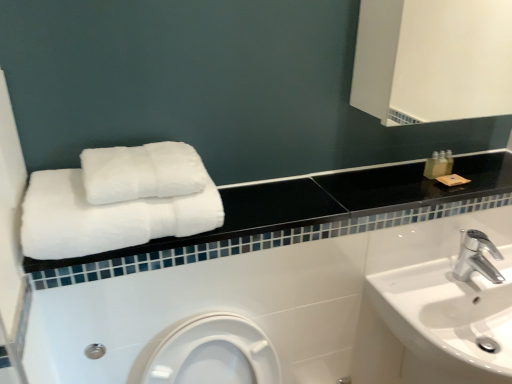
Describe the element at coordinates (434, 166) in the screenshot. I see `translucent plastic bottle at upper right` at that location.

The width and height of the screenshot is (512, 384). I want to click on translucent plastic bottle at upper right, so click(x=434, y=166).

Image resolution: width=512 pixels, height=384 pixels. What are the coordinates of `white fluffy towels at upper left, which is the 2th towel from top to bottom` in the screenshot? It's located at (105, 217).

Where is `white glossy sink at lower right`? The image size is (512, 384). white glossy sink at lower right is located at coordinates (437, 324).

Measure the distance between white soft towels at upper left and camera.

The depth of white soft towels at upper left is 33.00 inches.

Image resolution: width=512 pixels, height=384 pixels. Find the location of `translucent plastic bottle at upper right`. translucent plastic bottle at upper right is located at coordinates (434, 166).

From the image's perspective, is white soft towels at upper left below white glossy sink at lower right?

Actually, white soft towels at upper left appears above white glossy sink at lower right in the image.

Which is behind, white soft towels at upper left or white glossy sink at lower right?

white glossy sink at lower right is more distant.

From a real-world perspective, is white soft towels at upper left on top of white glossy sink at lower right?

Yes, from a real-world perspective, white soft towels at upper left is over white glossy sink at lower right

Can you see white soft towels at upper left touching white glossy sink at lower right?

white soft towels at upper left and white glossy sink at lower right are not in contact.

What's the angular difference between translucent plastic bottle at upper right and white glossy sink at lower right's facing directions?

The angle between the facing direction of translucent plastic bottle at upper right and the facing direction of white glossy sink at lower right is 2.08 degrees.

Can you confirm if translucent plastic bottle at upper right is shorter than white glossy sink at lower right?

Indeed, translucent plastic bottle at upper right has a lesser height compared to white glossy sink at lower right.

Which is nearer, (x=439, y=175) or (x=417, y=338)?

Point (x=439, y=175) appears to be farther away from the viewer than point (x=417, y=338).

Would you say translucent plastic bottle at upper right contains white glossy sink at lower right?

No.

Does translucent plastic bottle at upper right have a lesser height compared to white fluffy towels at center, the 1th towel viewed from the top?

No, translucent plastic bottle at upper right is not shorter than white fluffy towels at center, the 1th towel viewed from the top.

I want to click on towel that is the 2nd one above the translucent plastic bottle at upper right (from a real-world perspective), so click(x=142, y=172).

In the scene shown: Which is farther, (440, 155) or (124, 169)?

The point (440, 155) is more distant.

From a real-world perspective, between translucent plastic bottle at upper right and white fluffy towels at center, the 1th towel viewed from the top, who is vertically lower?

translucent plastic bottle at upper right, from a real-world perspective.

Considering the positions of points (489, 355) and (465, 251), is point (489, 355) closer to camera compared to point (465, 251)?

That is True.

Considering the relative sizes of white glossy sink at lower right and silver metallic faucet at lower right in the image provided, is white glossy sink at lower right wider than silver metallic faucet at lower right?

Indeed, white glossy sink at lower right has a greater width compared to silver metallic faucet at lower right.

Does white glossy sink at lower right appear on the left side of silver metallic faucet at lower right?

In fact, white glossy sink at lower right is to the right of silver metallic faucet at lower right.

Can you confirm if translucent plastic bottle at upper right is taller than white soft towels at upper left?

Indeed, translucent plastic bottle at upper right has a greater height compared to white soft towels at upper left.

Does translucent plastic bottle at upper right have a greater width compared to white soft towels at upper left?

Incorrect, the width of translucent plastic bottle at upper right does not surpass that of white soft towels at upper left.

Which is behind, point (441, 156) or point (498, 169)?

The point (441, 156) is farther from the camera.

Where is `balustrade in front of the translucent plastic bottle at upper right`? Image resolution: width=512 pixels, height=384 pixels. balustrade in front of the translucent plastic bottle at upper right is located at coordinates (302, 216).

You are a GUI agent. You are given a task and a screenshot of the screen. Output one action in this format:
    pyautogui.click(x=<x>, y=<y>)
    Task: Click on the towel above the white soft towels at upper left (from the image's perspective)
    
    Given the screenshot: What is the action you would take?
    pyautogui.click(x=142, y=172)

Are white fluffy towels at center, the 1th towel viewed from the top, and white soft towels at upper left located far from each other?

white fluffy towels at center, the 1th towel viewed from the top, is near white soft towels at upper left, not far away.

Considering the relative sizes of white fluffy towels at center, acting as the 2th towel starting from the bottom, and white soft towels at upper left in the image provided, is white fluffy towels at center, acting as the 2th towel starting from the bottom, wider than white soft towels at upper left?

In fact, white fluffy towels at center, acting as the 2th towel starting from the bottom, might be narrower than white soft towels at upper left.

Considering the sizes of white fluffy towels at center, acting as the 2th towel starting from the bottom, and white soft towels at upper left in the image, is white fluffy towels at center, acting as the 2th towel starting from the bottom, taller or shorter than white soft towels at upper left?

white fluffy towels at center, acting as the 2th towel starting from the bottom, is taller than white soft towels at upper left.

Does translucent plastic bottle at upper right have a lesser height compared to white fluffy towels at upper left, which is counted as the first towel, starting from the bottom?

Yes, translucent plastic bottle at upper right is shorter than white fluffy towels at upper left, which is counted as the first towel, starting from the bottom.

What's the angular difference between translucent plastic bottle at upper right and white fluffy towels at upper left, which is counted as the first towel, starting from the bottom,'s facing directions?

The facing directions of translucent plastic bottle at upper right and white fluffy towels at upper left, which is counted as the first towel, starting from the bottom, are 0.426 degrees apart.

Looking at this image, can you confirm if translucent plastic bottle at upper right is thinner than white fluffy towels at upper left, which is counted as the first towel, starting from the bottom?

Indeed, translucent plastic bottle at upper right has a lesser width compared to white fluffy towels at upper left, which is counted as the first towel, starting from the bottom.

Looking at this image, is translucent plastic bottle at upper right not inside white fluffy towels at upper left, which is the 2th towel from top to bottom?

translucent plastic bottle at upper right is positioned outside white fluffy towels at upper left, which is the 2th towel from top to bottom.

This screenshot has height=384, width=512. Find the location of `sink that is below the white soft towels at upper left (from the image's perspective)`. sink that is below the white soft towels at upper left (from the image's perspective) is located at coordinates (437, 324).

You are a GUI agent. You are given a task and a screenshot of the screen. Output one action in this format:
    pyautogui.click(x=<x>, y=<y>)
    Task: Click on the sink below the translucent plastic bottle at upper right (from a real-world perspective)
    The image size is (512, 384).
    Given the screenshot: What is the action you would take?
    pyautogui.click(x=437, y=324)

Which object lies further to the anchor point white fluffy towels at center, acting as the 2th towel starting from the bottom, silver metallic faucet at lower right or translucent plastic bottle at upper right?

Among the two, silver metallic faucet at lower right is located further to white fluffy towels at center, acting as the 2th towel starting from the bottom.

From the image, which object appears to be farther from white glossy sink at lower right, white fluffy towels at upper left, which is the 2th towel from top to bottom, or white fluffy towels at center, acting as the 2th towel starting from the bottom?

The object further to white glossy sink at lower right is white fluffy towels at center, acting as the 2th towel starting from the bottom.

Considering their positions, is translucent plastic bottle at upper right positioned further to silver metallic faucet at lower right than white soft towels at upper left?

white soft towels at upper left is positioned further to the anchor silver metallic faucet at lower right.

Estimate the real-world distances between objects in this image. Which object is closer to white fluffy towels at center, acting as the 2th towel starting from the bottom, white glossy sink at lower right or translucent plastic bottle at upper right?

white glossy sink at lower right is positioned closer to the anchor white fluffy towels at center, acting as the 2th towel starting from the bottom.

Looking at this image, estimate the real-world distances between objects in this image. Which object is closer to white fluffy towels at upper left, which is counted as the first towel, starting from the bottom, white fluffy towels at center, acting as the 2th towel starting from the bottom, or silver metallic faucet at lower right?

white fluffy towels at center, acting as the 2th towel starting from the bottom, is closer to white fluffy towels at upper left, which is counted as the first towel, starting from the bottom.

Which object lies further to the anchor point white soft towels at upper left, white fluffy towels at center, the 1th towel viewed from the top, or silver metallic faucet at lower right?

silver metallic faucet at lower right.

From the image, which object appears to be nearer to white fluffy towels at center, the 1th towel viewed from the top, translucent plastic bottle at upper right or white glossy sink at lower right?

white glossy sink at lower right.

Which object lies further to the anchor point white fluffy towels at center, acting as the 2th towel starting from the bottom, white glossy sink at lower right or white fluffy towels at upper left, which is counted as the first towel, starting from the bottom?

white glossy sink at lower right.

At what (x,y) coordinates should I click in order to perform the action: click on balustrade between translucent plastic bottle at upper right and white glossy sink at lower right in the up-down direction. Please return your answer as a coordinate pair (x, y). Looking at the image, I should click on coord(302,216).

This screenshot has width=512, height=384. I want to click on towel situated between white fluffy towels at upper left, which is the 2th towel from top to bottom, and silver metallic faucet at lower right from left to right, so click(142, 172).

At what (x,y) coordinates should I click in order to perform the action: click on balustrade between white fluffy towels at upper left, which is counted as the first towel, starting from the bottom, and white glossy sink at lower right. Please return your answer as a coordinate pair (x, y). This screenshot has width=512, height=384. Looking at the image, I should click on point(302,216).

The height and width of the screenshot is (384, 512). I want to click on tap located between white fluffy towels at upper left, which is counted as the first towel, starting from the bottom, and white glossy sink at lower right in the left-right direction, so click(476, 257).